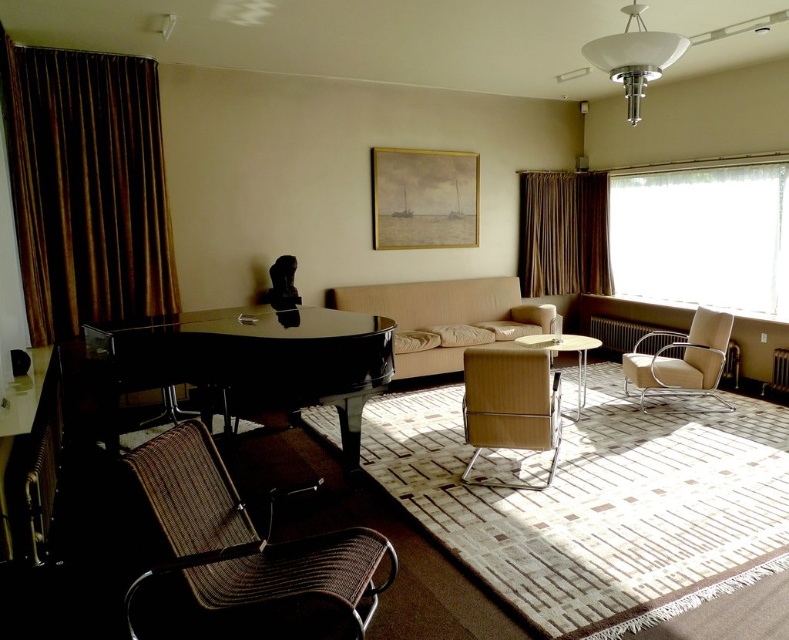
Question: From the image, what is the correct spatial relationship of glossy black piano at center in relation to woven brown armchair at lower left?

Choices:
 (A) left
 (B) right

Answer: (A)

Question: Which point is farther from the camera taking this photo?

Choices:
 (A) (539, 403)
 (B) (567, 250)
 (C) (773, 256)
 (D) (720, 324)

Answer: (B)

Question: Which object is farther from the camera taking this photo?

Choices:
 (A) metallic silver armchair at right
 (B) metallic silver table at center
 (C) leather-like beige armchair at center

Answer: (A)

Question: Among these objects, which one is farthest from the camera?

Choices:
 (A) leather-like beige armchair at center
 (B) beige leather couch at center
 (C) brown velvet curtain at right

Answer: (C)

Question: Is brown velvet curtain at left to the right of glossy black piano at center from the viewer's perspective?

Choices:
 (A) no
 (B) yes

Answer: (A)

Question: Does woven brown armchair at lower left come behind metallic silver table at center?

Choices:
 (A) no
 (B) yes

Answer: (A)